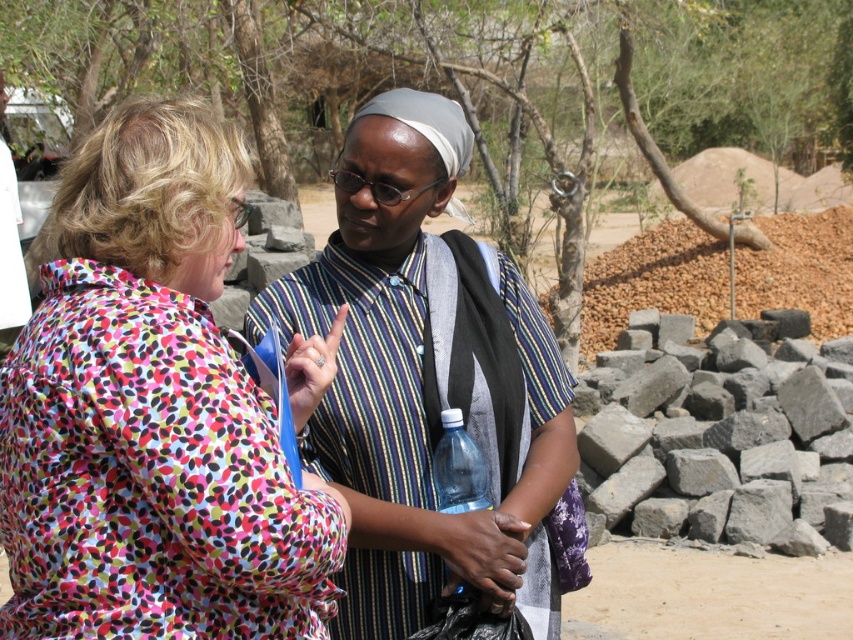
Is striped fabric shirt at center shorter than clear plastic bottle at center?

No, striped fabric shirt at center is not shorter than clear plastic bottle at center.

What do you see at coordinates (431, 385) in the screenshot? I see `striped fabric shirt at center` at bounding box center [431, 385].

I want to click on striped fabric shirt at center, so click(x=431, y=385).

Between white fabric shirt at upper left and clear plastic bottle at center, which one has more height?

With more height is white fabric shirt at upper left.

You are a GUI agent. You are given a task and a screenshot of the screen. Output one action in this format:
    pyautogui.click(x=<x>, y=<y>)
    Task: Click on the white fabric shirt at upper left
    This screenshot has width=853, height=640.
    Given the screenshot: What is the action you would take?
    pyautogui.click(x=10, y=257)

Describe the element at coordinates (10, 257) in the screenshot. I see `white fabric shirt at upper left` at that location.

Image resolution: width=853 pixels, height=640 pixels. What are the coordinates of `white fabric shirt at upper left` in the screenshot? It's located at (10, 257).

This screenshot has height=640, width=853. In order to click on printed fabric blouse at center in this screenshot , I will do `click(151, 412)`.

This screenshot has width=853, height=640. What do you see at coordinates (151, 412) in the screenshot? I see `printed fabric blouse at center` at bounding box center [151, 412].

Where is `printed fabric blouse at center`? The height and width of the screenshot is (640, 853). printed fabric blouse at center is located at coordinates (151, 412).

Identify the location of printed fabric blouse at center. (151, 412).